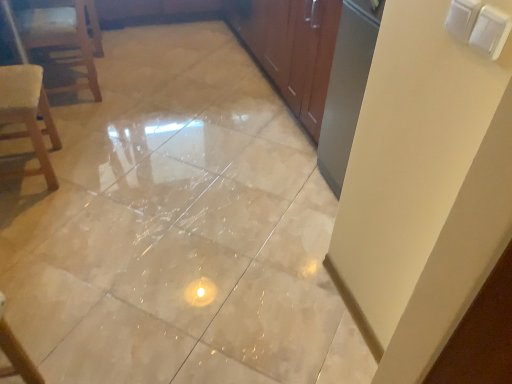
Question: Is wooden chair at left to the left or to the right of wooden textured chair at left in the image?

Choices:
 (A) left
 (B) right

Answer: (A)

Question: From the image's perspective, is wooden chair at left located above or below wooden textured chair at left?

Choices:
 (A) below
 (B) above

Answer: (B)

Question: Estimate the real-world distances between objects in this image. Which object is farther from the wooden textured chair at left?

Choices:
 (A) beige glossy tile at center
 (B) wooden chair at left

Answer: (A)

Question: Which object is positioned farthest from the beige glossy tile at center?

Choices:
 (A) wooden textured chair at left
 (B) wooden chair at left

Answer: (B)